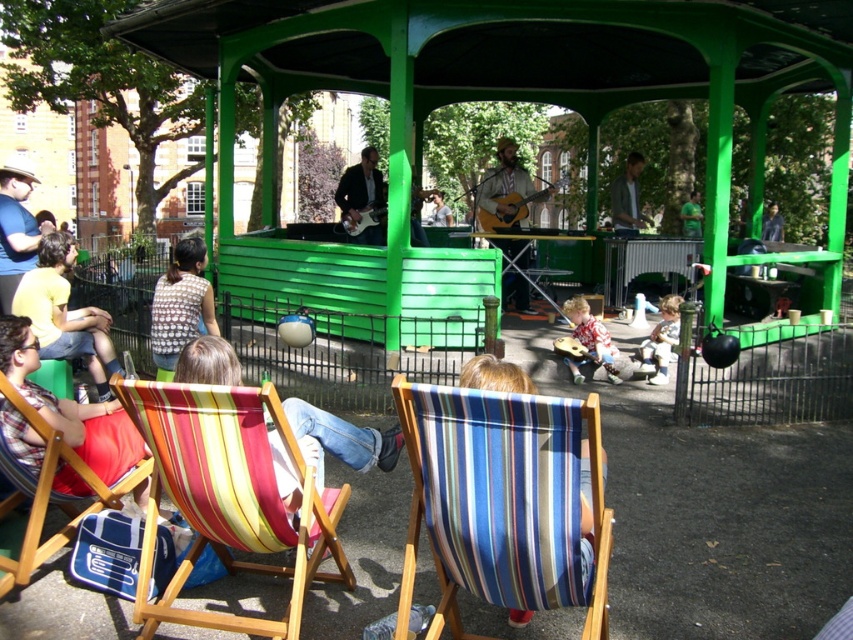
Question: Does striped fabric beach chair at lower left come in front of smooth brown guitar at center?

Choices:
 (A) no
 (B) yes

Answer: (B)

Question: Which point appears farthest from the camera in this image?

Choices:
 (A) (691, 218)
 (B) (408, 520)
 (C) (579, 317)

Answer: (A)

Question: Is gray fabric jacket at upper right positioned at the back of smooth brown guitar at center?

Choices:
 (A) yes
 (B) no

Answer: (B)

Question: Which of the following is the closest to the observer?

Choices:
 (A) (285, 464)
 (B) (502, 202)

Answer: (A)

Question: Is striped fabric chair at lower left to the left of smooth brown guitar at center from the viewer's perspective?

Choices:
 (A) yes
 (B) no

Answer: (A)

Question: Based on their relative distances, which object is nearer to the green matte shirt at center?

Choices:
 (A) light brown wooden guitar at lower center
 (B) striped fabric chair at center
 (C) gray fabric jacket at upper right
 (D) light brown acoustic guitar at center

Answer: (C)